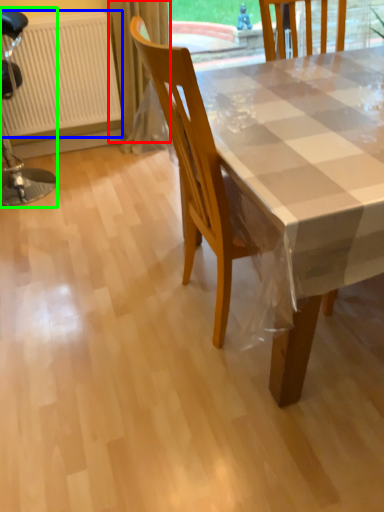
Question: Which object is positioned closest to curtain (highlighted by a red box)? Select from radiator (highlighted by a blue box) and chair (highlighted by a green box).

Choices:
 (A) radiator
 (B) chair

Answer: (A)